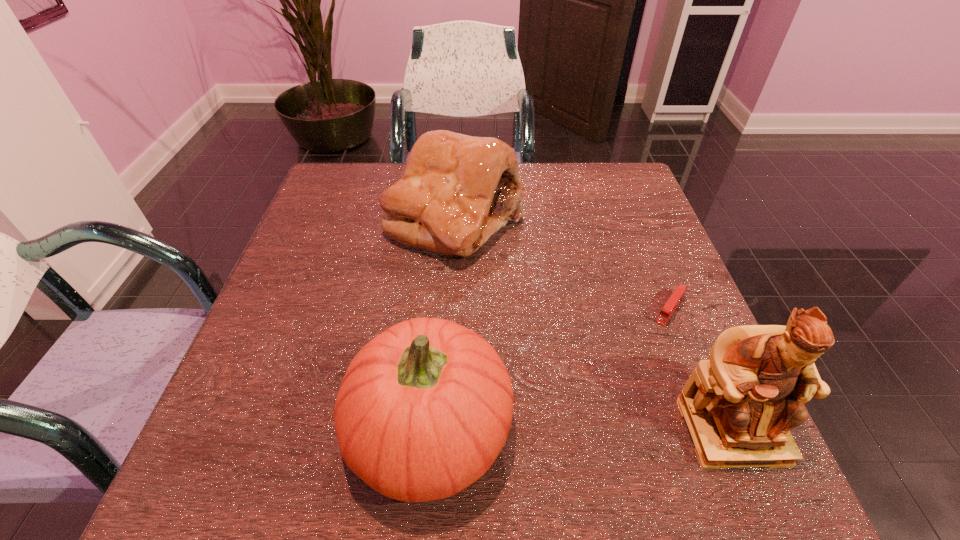
At what (x,y) coordinates should I click in order to perform the action: click on vacant space at the near edge of the desktop. Please return your answer as a coordinate pair (x, y). This screenshot has width=960, height=540. Looking at the image, I should click on (587, 426).

I want to click on vacant space at the left edge of the desktop, so click(294, 244).

The image size is (960, 540). What are the coordinates of `vacant space at the right edge of the desktop` in the screenshot? It's located at (634, 225).

At what (x,y) coordinates should I click in order to perform the action: click on free region at the far left corner. Please return your answer as a coordinate pair (x, y). Looking at the image, I should click on (327, 207).

The image size is (960, 540). I want to click on free spot between the pumpkin and the stapler, so click(550, 368).

I want to click on empty space between the pumpkin and the shortest object, so 550,368.

I want to click on free spot between the shortest object and the pumpkin, so click(550, 368).

At what (x,y) coordinates should I click in order to perform the action: click on free area in between the tallest object and the pumpkin. Please return your answer as a coordinate pair (x, y). Looking at the image, I should click on (581, 429).

The image size is (960, 540). Identify the location of free area in between the shortest object and the bread. point(563,264).

Image resolution: width=960 pixels, height=540 pixels. Identify the location of vacant point located between the tallest object and the farthest object. (593, 325).